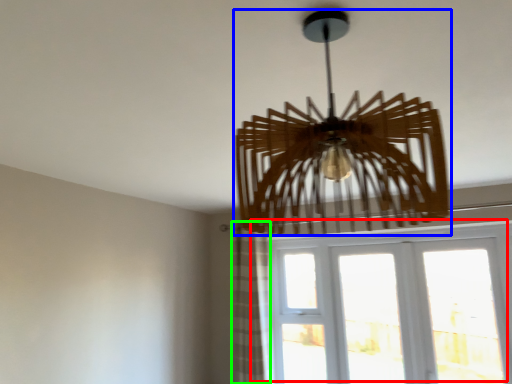
Question: Considering the real-world distances, which object is farthest from window (highlighted by a red box)? lamp (highlighted by a blue box) or curtain (highlighted by a green box)?

Choices:
 (A) lamp
 (B) curtain

Answer: (A)